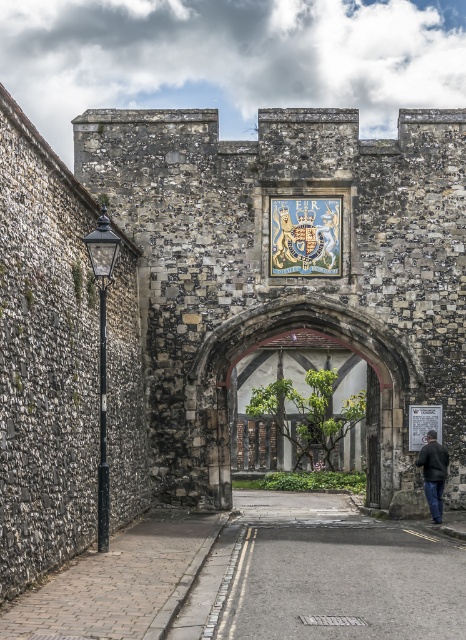
Between wooden at center and dark gray jacket at center, which one has less height?

dark gray jacket at center is shorter.

Does point (370, 480) come farther from viewer compared to point (424, 465)?

Yes, point (370, 480) is farther from viewer.

Is point (369, 426) behind point (433, 509)?

Yes, it is behind point (433, 509).

This screenshot has height=640, width=466. Identify the location of wooden at center. (372, 438).

What do you see at coordinates (321, 404) in the screenshot? I see `brown wooden gate at center` at bounding box center [321, 404].

Which is more to the right, brown wooden gate at center or wooden at center?

wooden at center is more to the right.

Who is more forward, [344,454] or [376,429]?

Positioned in front is point [376,429].

Image resolution: width=466 pixels, height=640 pixels. What are the coordinates of `brown wooden gate at center` in the screenshot? It's located at (321, 404).

Who is more distant from viewer, (255, 456) or (439, 465)?

The point (255, 456) is more distant.

Is brown wooden gate at center to the right of dark gray jacket at center from the viewer's perspective?

No, brown wooden gate at center is not to the right of dark gray jacket at center.

Who is more distant from viewer, (283,401) or (427,467)?

The point (283,401) is more distant.

Where is `brown wooden gate at center`? The image size is (466, 640). brown wooden gate at center is located at coordinates (321, 404).